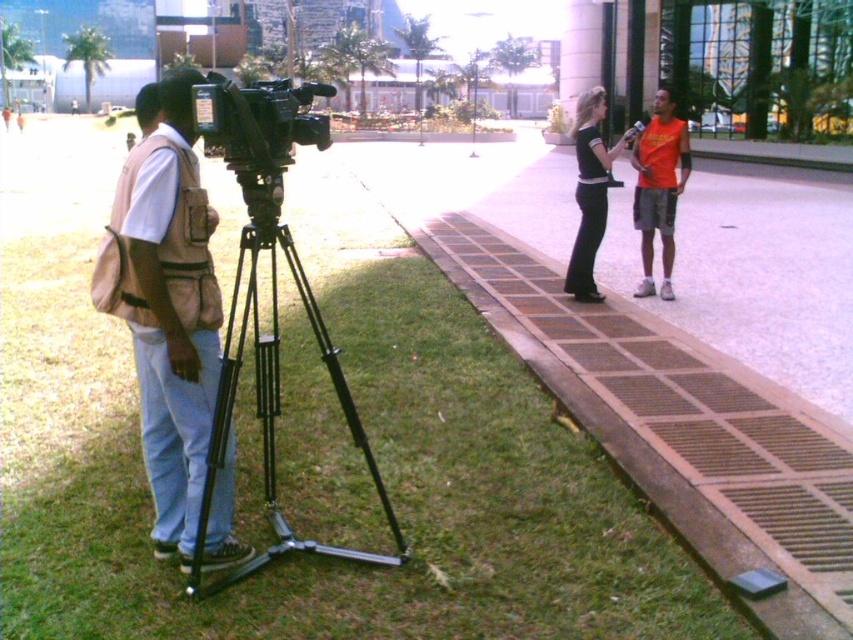
Is beige fabric vest at left smaller than black smooth pants at center?

Correct, beige fabric vest at left occupies less space than black smooth pants at center.

Between point (154, 141) and point (582, 147), which one is positioned in front?

Positioned in front is point (154, 141).

You are a GUI agent. You are given a task and a screenshot of the screen. Output one action in this format:
    pyautogui.click(x=<x>, y=<y>)
    Task: Click on the beige fabric vest at left
    This screenshot has width=853, height=640.
    Given the screenshot: What is the action you would take?
    pyautogui.click(x=169, y=316)

Can you confirm if black matte video camera at center is positioned to the left of black smooth pants at center?

Indeed, black matte video camera at center is positioned on the left side of black smooth pants at center.

Can you confirm if black matte video camera at center is taller than black smooth pants at center?

Correct, black matte video camera at center is much taller as black smooth pants at center.

Measure the distance between point (265, 118) and camera.

A distance of 3.07 meters exists between point (265, 118) and camera.

Identify the location of black matte video camera at center. (259, 120).

Is green grass at lower left below orange cotton shirt at right?

Correct, green grass at lower left is located below orange cotton shirt at right.

Is point (57, 636) behind point (660, 125)?

That is False.

Between point (448, 612) and point (646, 172), which one is positioned behind?

The point (646, 172) is more distant.

What are the coordinates of `green grass at lower left` in the screenshot? It's located at (393, 506).